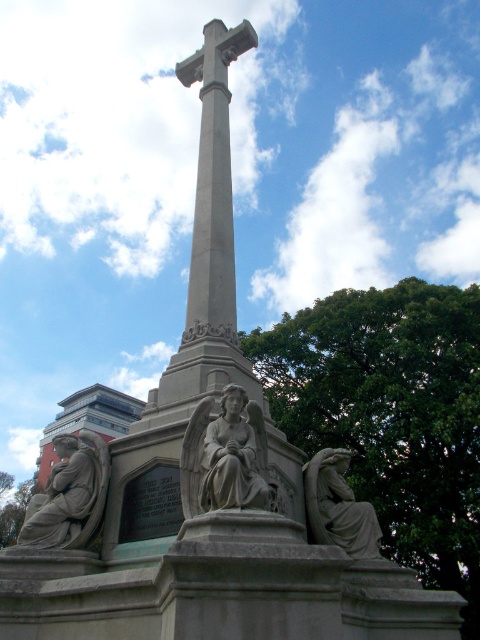
Who is more forward, [218,440] or [200,70]?

Point [218,440] is in front.

At what (x,y) coordinates should I click in order to perform the action: click on matte gray statue at center. Please return your answer as a coordinate pair (x, y). This screenshot has width=480, height=640. Looking at the image, I should click on (236, 456).

Image resolution: width=480 pixels, height=640 pixels. I want to click on matte gray statue at center, so click(236, 456).

Does point (252, 488) lie behind point (377, 554)?

That is False.

Image resolution: width=480 pixels, height=640 pixels. I want to click on matte gray statue at center, so click(236, 456).

Does stone statue at lower left appear on the left side of gray stone cross at center?

Correct, you'll find stone statue at lower left to the left of gray stone cross at center.

Between point (60, 456) and point (204, 70), which one is positioned behind?

Point (204, 70)

Between point (90, 508) and point (248, 26), which one is positioned behind?

Positioned behind is point (248, 26).

Find the location of a particular element. The width and height of the screenshot is (480, 640). stone statue at lower left is located at coordinates (69, 493).